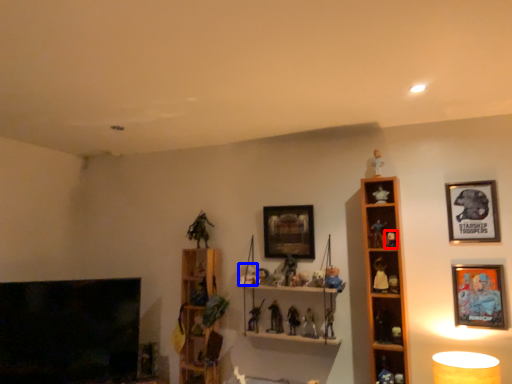
Question: Which of the following is the farthest to the observer, toy (highlighted by a red box) or toy (highlighted by a blue box)?

Choices:
 (A) toy
 (B) toy

Answer: (B)